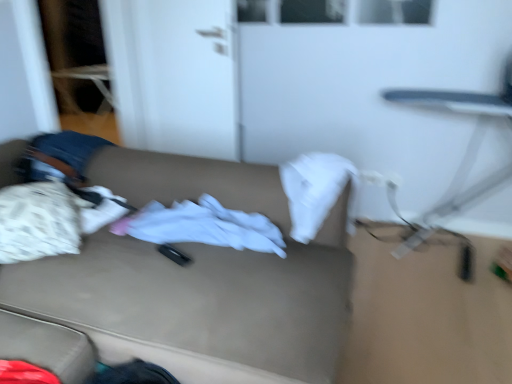
Question: In terms of height, does white soft cloth at center look taller or shorter compared to beige fabric couch at center?

Choices:
 (A) tall
 (B) short

Answer: (B)

Question: Based on their positions, is white soft cloth at center located to the left or right of beige fabric couch at center?

Choices:
 (A) right
 (B) left

Answer: (A)

Question: Considering the real-world distances, which object is farthest from the beige fabric couch at center?

Choices:
 (A) white matte door at upper left
 (B) metallic silver swivel chair at right
 (C) white soft cloth at center

Answer: (B)

Question: Estimate the real-world distances between objects in this image. Which object is closer to the white matte door at upper left?

Choices:
 (A) metallic silver swivel chair at right
 (B) white soft cloth at center
 (C) beige fabric couch at center

Answer: (C)